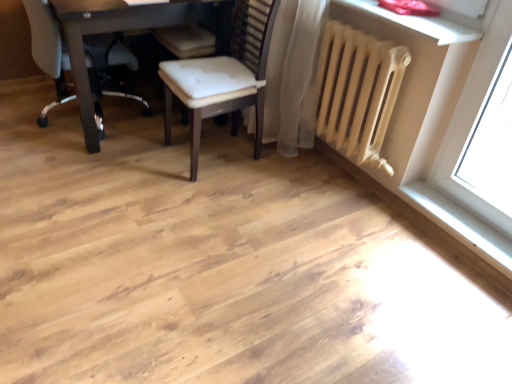
Question: Is matte dark brown table at upper left looking in the opposite direction of white leather chair at upper left, acting as the 2th chair starting from the right?

Choices:
 (A) no
 (B) yes

Answer: (B)

Question: Is matte dark brown table at upper left positioned before white leather chair at upper left, acting as the 2th chair starting from the right?

Choices:
 (A) no
 (B) yes

Answer: (B)

Question: Is matte dark brown table at upper left oriented towards white leather chair at upper left, the 1th chair in the left-to-right sequence?

Choices:
 (A) yes
 (B) no

Answer: (A)

Question: From the image's perspective, is matte dark brown table at upper left above white leather chair at upper left, the 1th chair in the left-to-right sequence?

Choices:
 (A) yes
 (B) no

Answer: (A)

Question: Considering the relative positions of matte dark brown table at upper left and white leather chair at upper left, the 1th chair in the left-to-right sequence, in the image provided, is matte dark brown table at upper left to the left of white leather chair at upper left, the 1th chair in the left-to-right sequence, from the viewer's perspective?

Choices:
 (A) no
 (B) yes

Answer: (A)

Question: Looking at the image, does matte dark brown table at upper left seem bigger or smaller compared to white leather chair at upper left, the 1th chair in the left-to-right sequence?

Choices:
 (A) big
 (B) small

Answer: (A)

Question: Is point (68, 3) positioned closer to the camera than point (58, 56)?

Choices:
 (A) farther
 (B) closer

Answer: (B)

Question: Considering the relative positions of matte dark brown table at upper left and white leather chair at upper left, acting as the 2th chair starting from the right, in the image provided, is matte dark brown table at upper left to the left or to the right of white leather chair at upper left, acting as the 2th chair starting from the right,?

Choices:
 (A) right
 (B) left

Answer: (A)

Question: In terms of width, does matte dark brown table at upper left look wider or thinner when compared to white leather chair at upper left, acting as the 2th chair starting from the right?

Choices:
 (A) thin
 (B) wide

Answer: (B)

Question: Is point (172, 64) closer or farther from the camera than point (350, 114)?

Choices:
 (A) closer
 (B) farther

Answer: (B)

Question: From the image's perspective, relative to beige matte radiator at upper right, is wooden chair at center, the 1th chair in the right-to-left sequence, above or below?

Choices:
 (A) below
 (B) above

Answer: (B)

Question: Is wooden chair at center, which is the 2th chair in left-to-right order, situated inside beige matte radiator at upper right or outside?

Choices:
 (A) inside
 (B) outside

Answer: (B)

Question: Is wooden chair at center, the 1th chair in the right-to-left sequence, wider or thinner than beige matte radiator at upper right?

Choices:
 (A) wide
 (B) thin

Answer: (A)

Question: From a real-world perspective, is white smooth window sill at lower right physically located above or below beige matte radiator at upper right?

Choices:
 (A) above
 (B) below

Answer: (B)

Question: Is white smooth window sill at lower right spatially inside beige matte radiator at upper right, or outside of it?

Choices:
 (A) outside
 (B) inside

Answer: (A)